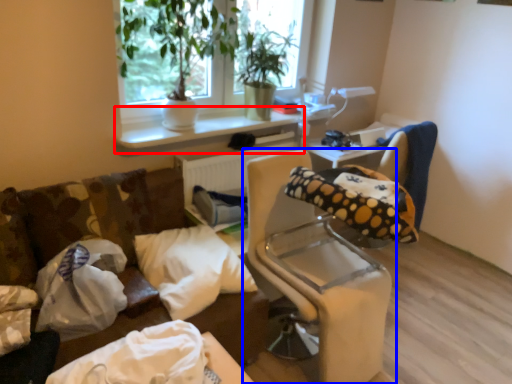
Question: Which of the following is the closest to the observer, window sill (highlighted by a red box) or furniture (highlighted by a blue box)?

Choices:
 (A) window sill
 (B) furniture

Answer: (B)